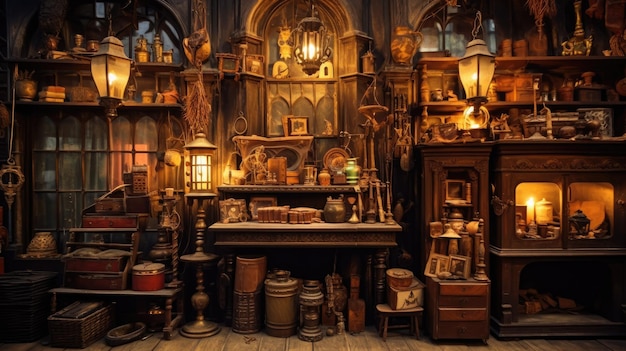
Where is `lanterns`? The width and height of the screenshot is (626, 351). lanterns is located at coordinates (108, 61), (201, 172), (310, 43), (479, 75).